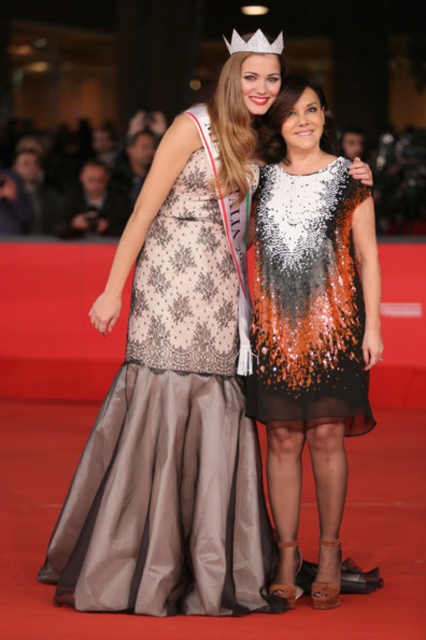
Question: Does matte beige lace dress at center appear on the right side of matte silver gown at center?

Choices:
 (A) yes
 (B) no

Answer: (B)

Question: Which point is farther to the camera?

Choices:
 (A) (325, 280)
 (B) (111, 147)
 (C) (278, 275)

Answer: (B)

Question: Is sequined fabric dress at center closer to the viewer compared to matte beige dress at upper center?

Choices:
 (A) no
 (B) yes

Answer: (B)

Question: Among these points, which one is farthest from the camera?

Choices:
 (A) (235, 35)
 (B) (109, 227)
 (C) (354, 401)
 (D) (270, 269)

Answer: (B)

Question: Which object is the closest to the sequined sheer dress at center?

Choices:
 (A) matte silver gown at center
 (B) matte beige lace dress at center

Answer: (B)

Question: Is the position of sequined fabric dress at center less distant than that of matte beige dress at upper center?

Choices:
 (A) no
 (B) yes

Answer: (B)